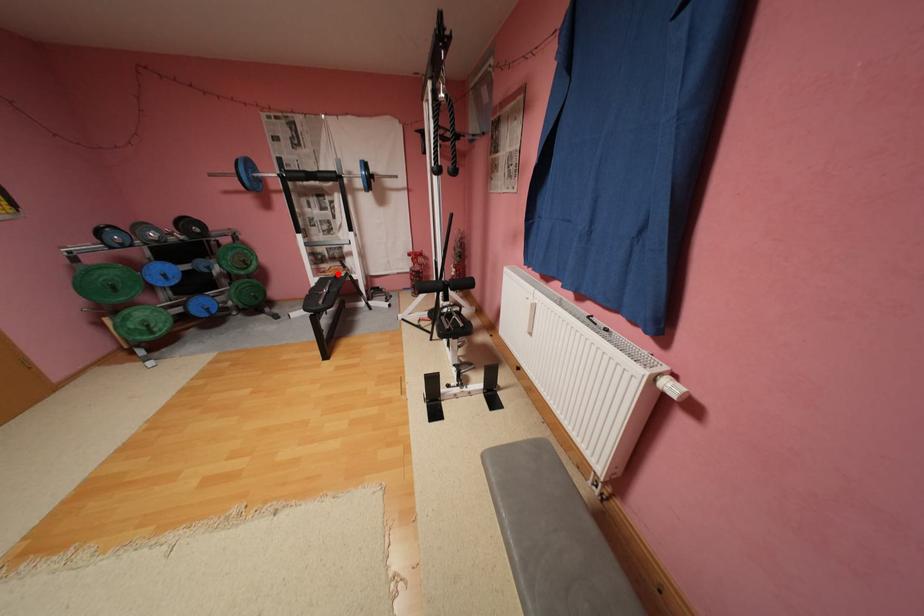
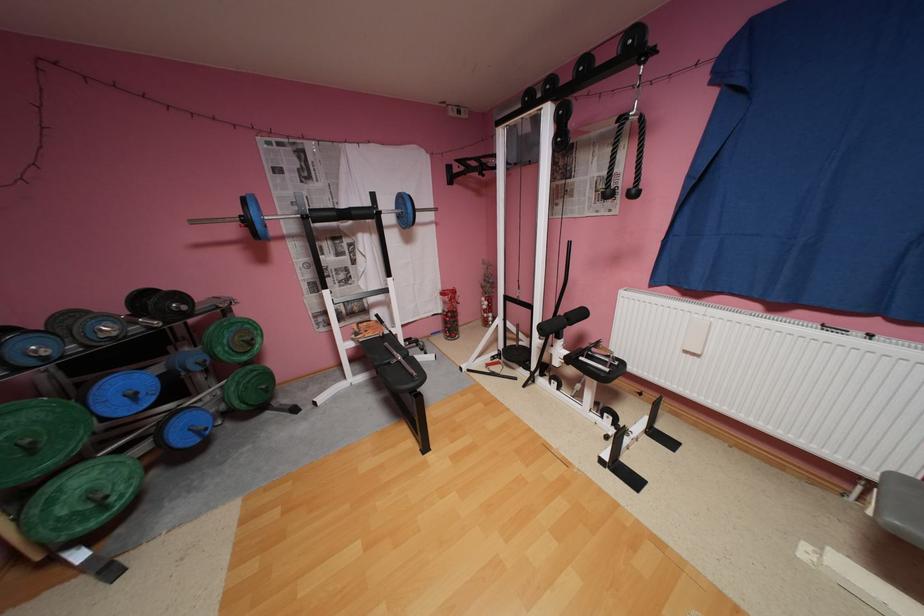
Question: I am providing you with two images of the same scene from different viewpoints. A red point is shown in image1. For the corresponding object point in image2, is it positioned nearer or farther from the camera?

Choices:
 (A) Nearer
 (B) Farther

Answer: (B)